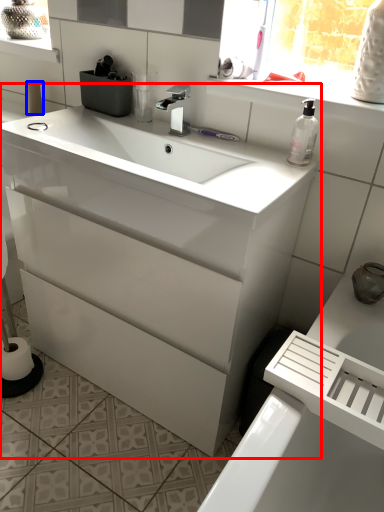
Question: Among these objects, which one is nearest to the camera, bathroom cabinet (highlighted by a red box) or toilet paper (highlighted by a blue box)?

Choices:
 (A) bathroom cabinet
 (B) toilet paper

Answer: (A)